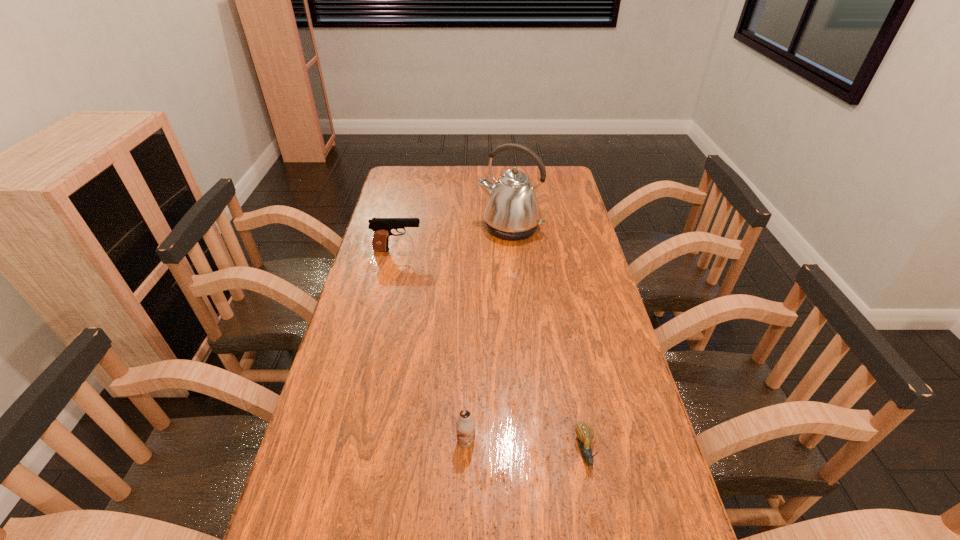
Find the location of a particular element. the farthest object is located at coordinates (512, 212).

Where is `kettle`? This screenshot has height=540, width=960. kettle is located at coordinates (512, 212).

I want to click on the third nearest object, so click(x=382, y=227).

I want to click on the leftmost object, so click(382, 227).

Image resolution: width=960 pixels, height=540 pixels. Find the location of `chocolate milk`. chocolate milk is located at coordinates (465, 424).

Where is `escargot`? Image resolution: width=960 pixels, height=540 pixels. escargot is located at coordinates (585, 433).

Where is `free space located 0.340m on the left of the farthest object`? The image size is (960, 540). free space located 0.340m on the left of the farthest object is located at coordinates (388, 228).

At what (x,y) coordinates should I click in order to perform the action: click on free point located at the barrel of the pistol. Please return your answer as a coordinate pair (x, y). The image size is (960, 540). Looking at the image, I should click on (440, 250).

At what (x,y) coordinates should I click in order to perform the action: click on vacant space located on the right of the chocolate milk. Please return your answer as a coordinate pair (x, y). Image resolution: width=960 pixels, height=540 pixels. Looking at the image, I should click on (523, 441).

You are a GUI agent. You are given a task and a screenshot of the screen. Output one action in this format:
    pyautogui.click(x=<x>, y=<y>)
    Task: Click on the free space located on the front-facing side of the shortest object
    Image resolution: width=960 pixels, height=540 pixels.
    Given the screenshot: What is the action you would take?
    pyautogui.click(x=602, y=539)